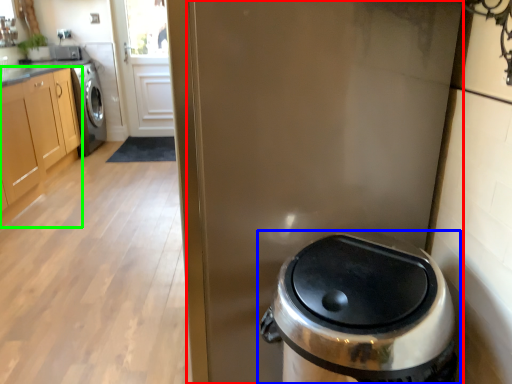
Question: Estimate the real-world distances between objects in this image. Which object is closer to screen door (highlighted by a red box), waste container (highlighted by a blue box) or cabinetry (highlighted by a green box)?

Choices:
 (A) waste container
 (B) cabinetry

Answer: (A)